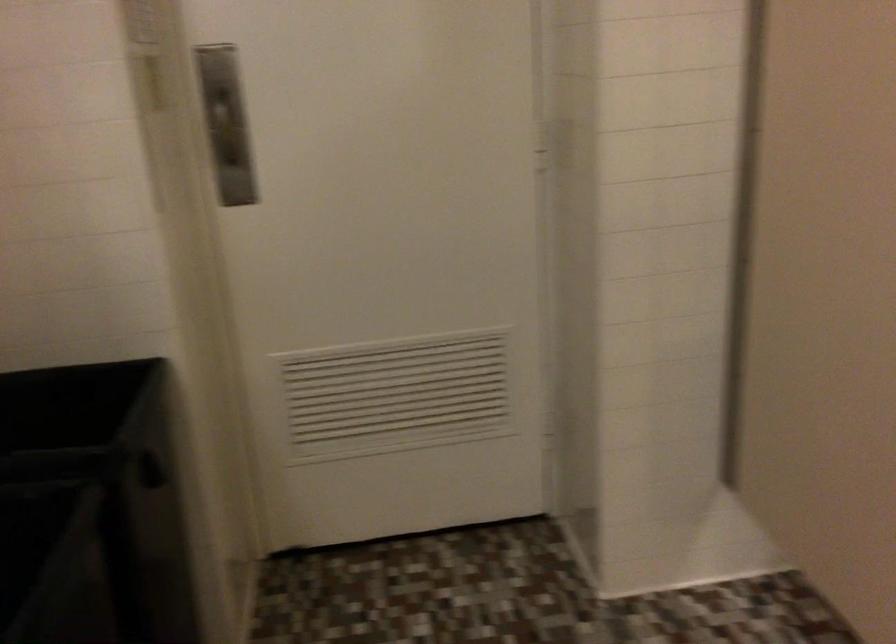
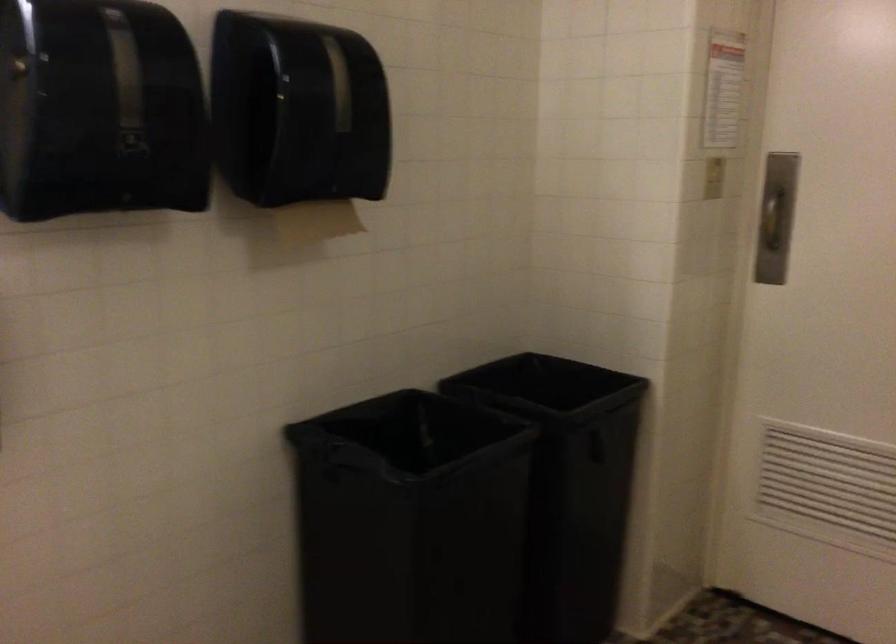
Locate, in the second image, the point that corresponds to the point at 235,129 in the first image.

(776, 216)